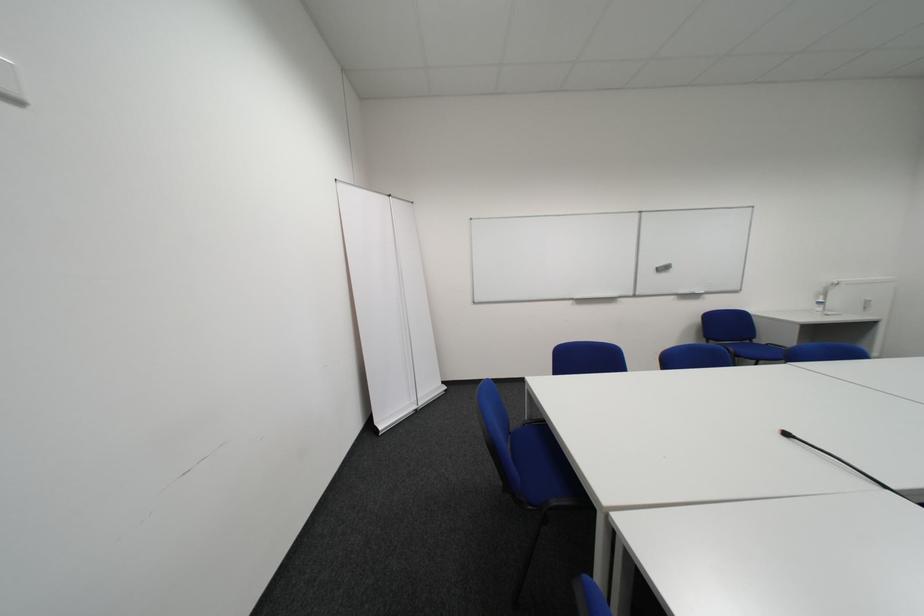
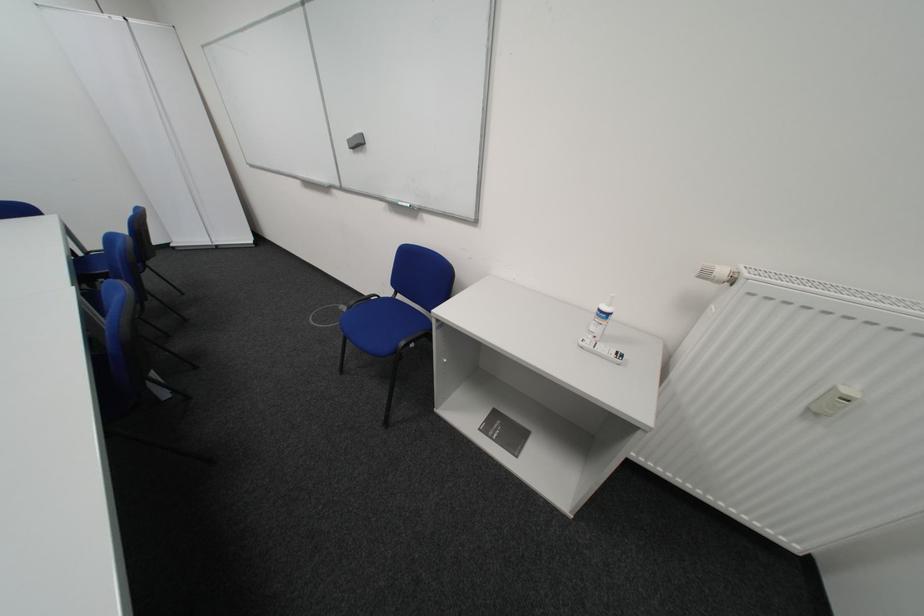
Find the pixel in the second image that matches pixel 669 270 in the first image.

(361, 143)